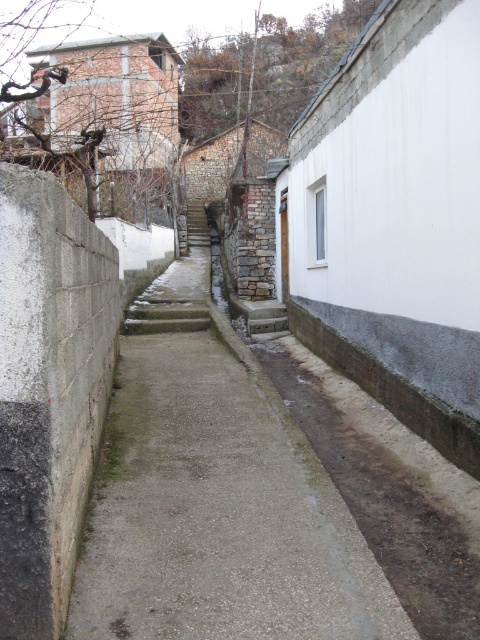
Question: Is gray concrete path at center bigger than stone textured stairs at center?

Choices:
 (A) no
 (B) yes

Answer: (B)

Question: Which object is closer to the camera taking this photo?

Choices:
 (A) gray concrete path at center
 (B) stone textured stairs at center

Answer: (A)

Question: Can you confirm if gray concrete path at center is smaller than stone textured stairs at center?

Choices:
 (A) no
 (B) yes

Answer: (A)

Question: Which object is farther from the camera taking this photo?

Choices:
 (A) gray concrete path at center
 (B) stone textured stairs at center

Answer: (B)

Question: Is gray concrete path at center further to the viewer compared to stone textured stairs at center?

Choices:
 (A) yes
 (B) no

Answer: (B)